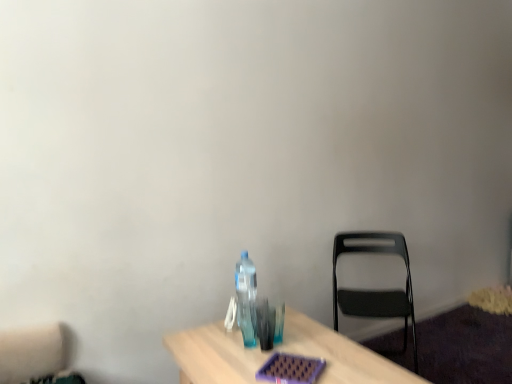
Where is `black plastic chair at right`? The width and height of the screenshot is (512, 384). black plastic chair at right is located at coordinates (376, 290).

The height and width of the screenshot is (384, 512). What do you see at coordinates (376, 290) in the screenshot? I see `black plastic chair at right` at bounding box center [376, 290].

In order to click on transparent plastic bottle at center in this screenshot , I will do `click(246, 299)`.

Image resolution: width=512 pixels, height=384 pixels. What do you see at coordinates (246, 299) in the screenshot?
I see `transparent plastic bottle at center` at bounding box center [246, 299].

At what (x,y) coordinates should I click in order to perform the action: click on black plastic chair at right. Please return your answer as a coordinate pair (x, y). Looking at the image, I should click on (376, 290).

Based on their positions, is black plastic chair at right located to the left or right of transparent plastic bottle at center?

Clearly, black plastic chair at right is on the right of transparent plastic bottle at center in the image.

Considering the relative positions of black plastic chair at right and transparent plastic bottle at center in the image provided, is black plastic chair at right behind transparent plastic bottle at center?

That is True.

Is point (410, 315) positioned before point (245, 281)?

No, (410, 315) is further to viewer.

From the image's perspective, does black plastic chair at right appear higher than transparent plastic bottle at center?

Actually, black plastic chair at right appears below transparent plastic bottle at center in the image.

From a real-world perspective, is black plastic chair at right positioned over transparent plastic bottle at center based on gravity?

No.

In terms of width, does black plastic chair at right look wider or thinner when compared to transparent plastic bottle at center?

Clearly, black plastic chair at right has more width compared to transparent plastic bottle at center.

Considering the relative sizes of black plastic chair at right and transparent plastic bottle at center in the image provided, is black plastic chair at right shorter than transparent plastic bottle at center?

Incorrect, the height of black plastic chair at right does not fall short of that of transparent plastic bottle at center.

From the picture: Considering the relative sizes of black plastic chair at right and transparent plastic bottle at center in the image provided, is black plastic chair at right bigger than transparent plastic bottle at center?

Correct, black plastic chair at right is larger in size than transparent plastic bottle at center.

Is black plastic chair at right situated inside transparent plastic bottle at center or outside?

black plastic chair at right is located beyond the bounds of transparent plastic bottle at center.

Is black plastic chair at right positioned far away from transparent plastic bottle at center?

No.

Is transparent plastic bottle at center at the back of black plastic chair at right?

No, black plastic chair at right is not facing the opposite direction of transparent plastic bottle at center.

How much distance is there between black plastic chair at right and transparent plastic bottle at center?

black plastic chair at right and transparent plastic bottle at center are 89.55 centimeters apart.

Image resolution: width=512 pixels, height=384 pixels. I want to click on chair located underneath the transparent plastic bottle at center (from a real-world perspective), so click(x=376, y=290).

Based on their positions, is transparent plastic bottle at center located to the left or right of black plastic chair at right?

From the image, it's evident that transparent plastic bottle at center is to the left of black plastic chair at right.

Considering the positions of objects transparent plastic bottle at center and black plastic chair at right in the image provided, who is behind, transparent plastic bottle at center or black plastic chair at right?

black plastic chair at right is further from the camera.

Which is closer, (249, 275) or (391, 309)?

The point (249, 275) is closer.

From the image's perspective, which one is positioned higher, transparent plastic bottle at center or black plastic chair at right?

transparent plastic bottle at center appears higher in the image.

From a real-world perspective, does transparent plastic bottle at center sit lower than black plastic chair at right?

Actually, transparent plastic bottle at center is physically above black plastic chair at right in the real world.

Which of these two, transparent plastic bottle at center or black plastic chair at right, is wider?

With larger width is black plastic chair at right.

Who is taller, transparent plastic bottle at center or black plastic chair at right?

black plastic chair at right.

Considering the sizes of transparent plastic bottle at center and black plastic chair at right in the image, is transparent plastic bottle at center bigger or smaller than black plastic chair at right?

transparent plastic bottle at center is smaller than black plastic chair at right.

Is transparent plastic bottle at center not inside black plastic chair at right?

Yes, transparent plastic bottle at center is located beyond the bounds of black plastic chair at right.

Are transparent plastic bottle at center and black plastic chair at right far apart?

No.

Is transparent plastic bottle at center turned away from black plastic chair at right?

No.

How far apart are transparent plastic bottle at center and black plastic chair at right?

transparent plastic bottle at center is 35.26 inches away from black plastic chair at right.

Where is `bottle in front of the black plastic chair at right`? bottle in front of the black plastic chair at right is located at coordinates (246, 299).

The image size is (512, 384). In order to click on bottle positioned vertically above the black plastic chair at right (from a real-world perspective) in this screenshot , I will do `click(246, 299)`.

Where is `bottle that appears on the left of black plastic chair at right`? This screenshot has width=512, height=384. bottle that appears on the left of black plastic chair at right is located at coordinates (246, 299).